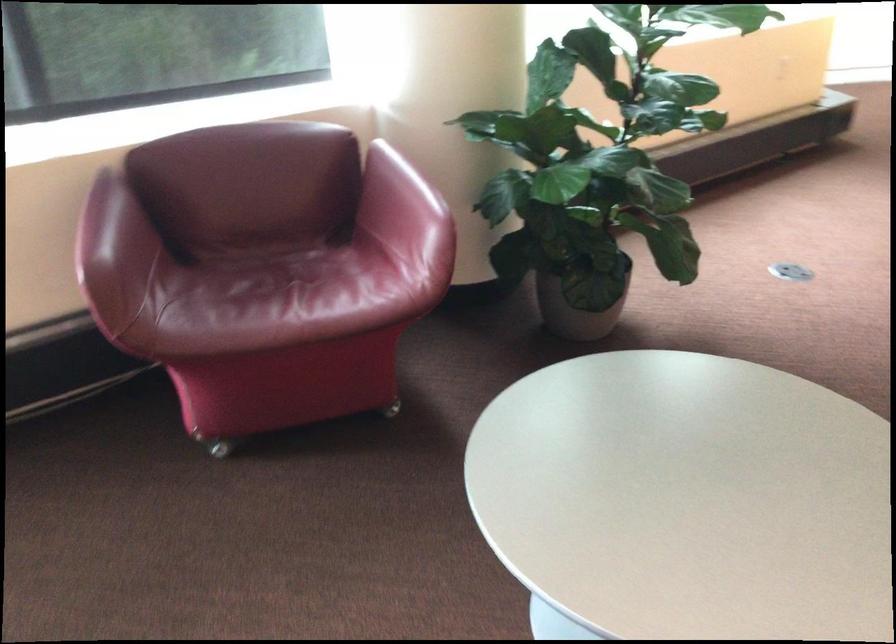
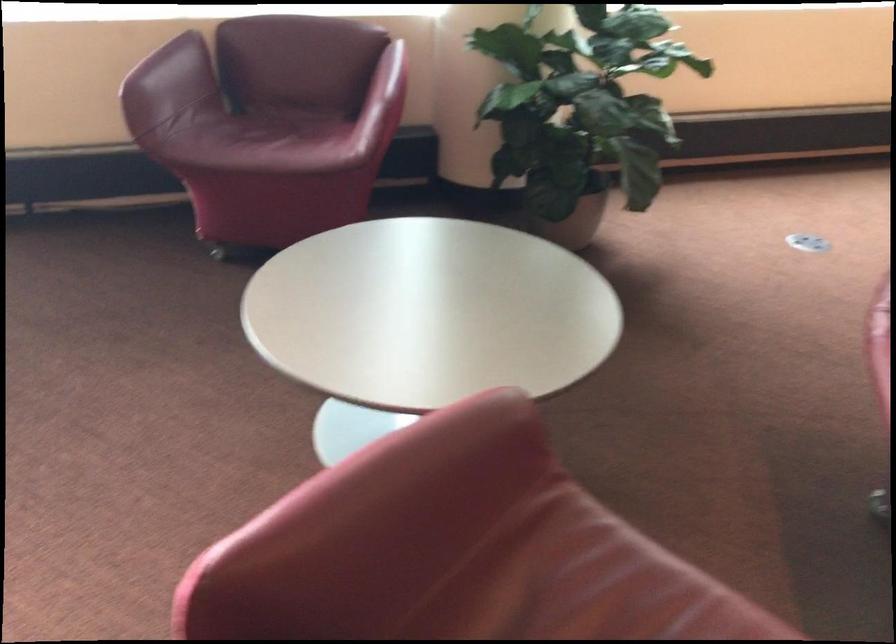
Find the pixel in the second image that matches pixel 455 222 in the first image.

(385, 100)